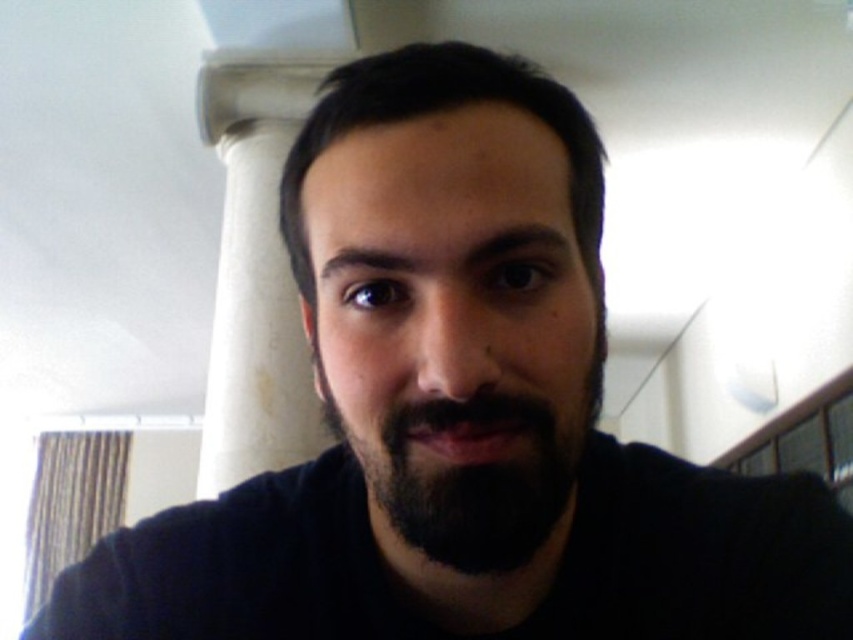
Which is more to the left, white marble pillar at upper center or black fuzzy beard at center?

white marble pillar at upper center

Does white marble pillar at upper center have a greater height compared to black fuzzy beard at center?

Yes.

Is point (277, 74) less distant than point (428, 512)?

No, it is not.

Where is `white marble pillar at upper center`? The height and width of the screenshot is (640, 853). white marble pillar at upper center is located at coordinates (254, 272).